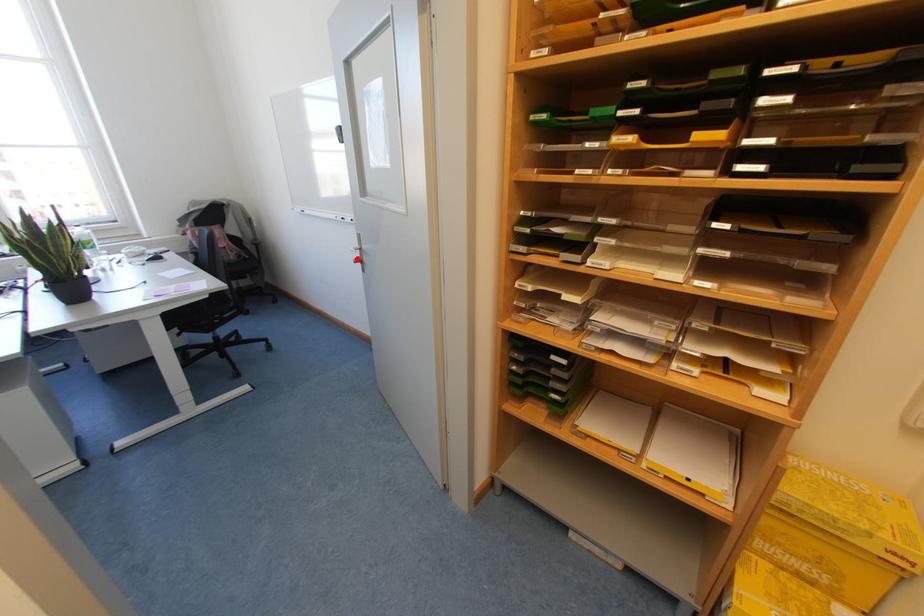
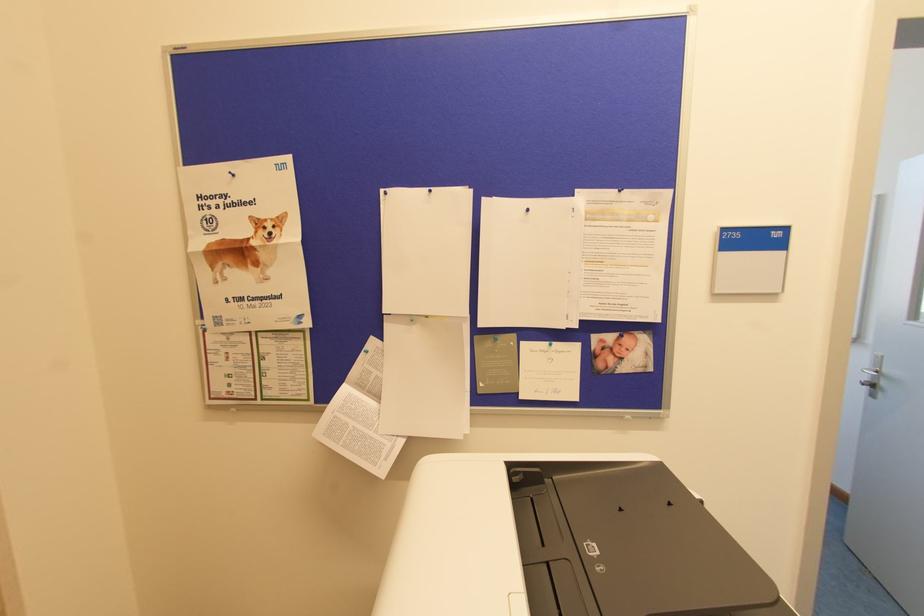
In the second image, find the point that corresponds to the highlighted location in the first image.

(868, 382)